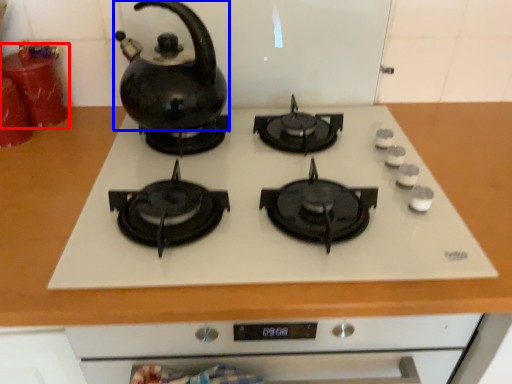
Question: Which point is closer to the camera, kitchen appliance (highlighted by a red box) or kettle (highlighted by a blue box)?

Choices:
 (A) kitchen appliance
 (B) kettle

Answer: (B)